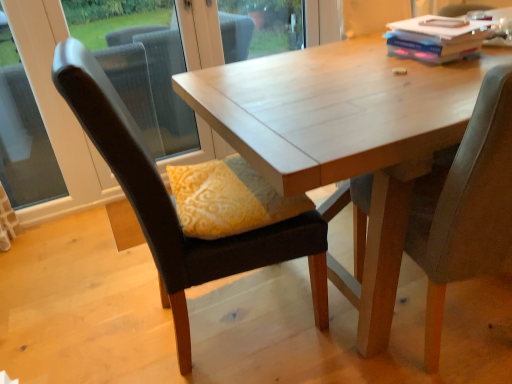
Locate an element on the screen. free point above hardcover book at upper right (from a real-world perspective) is located at coordinates (439, 26).